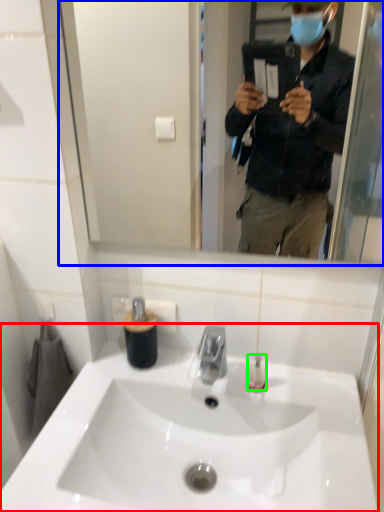
Question: Which object is positioned closest to sink (highlighted by a red box)? Select from mirror (highlighted by a blue box) and toiletry (highlighted by a green box).

Choices:
 (A) mirror
 (B) toiletry

Answer: (B)